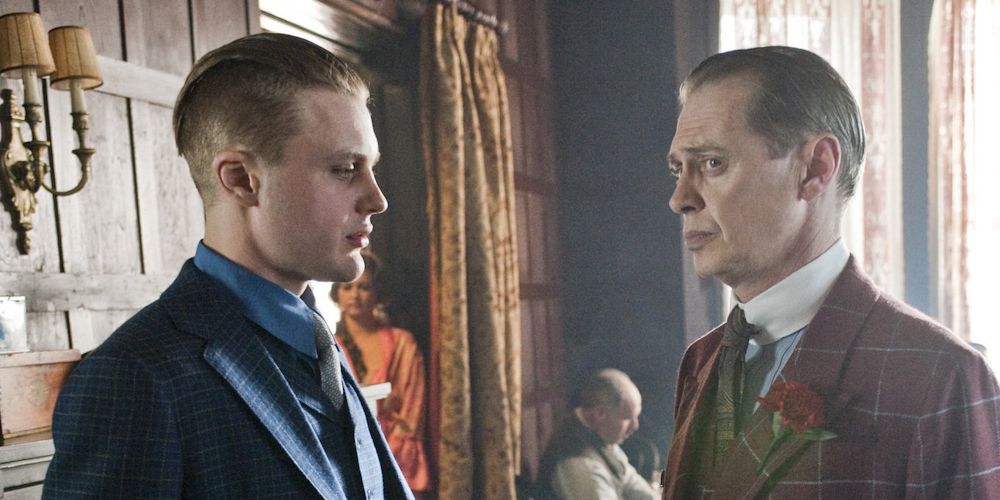
The width and height of the screenshot is (1000, 500). Find the location of `wood  paneling`. wood  paneling is located at coordinates (135, 159), (532, 108).